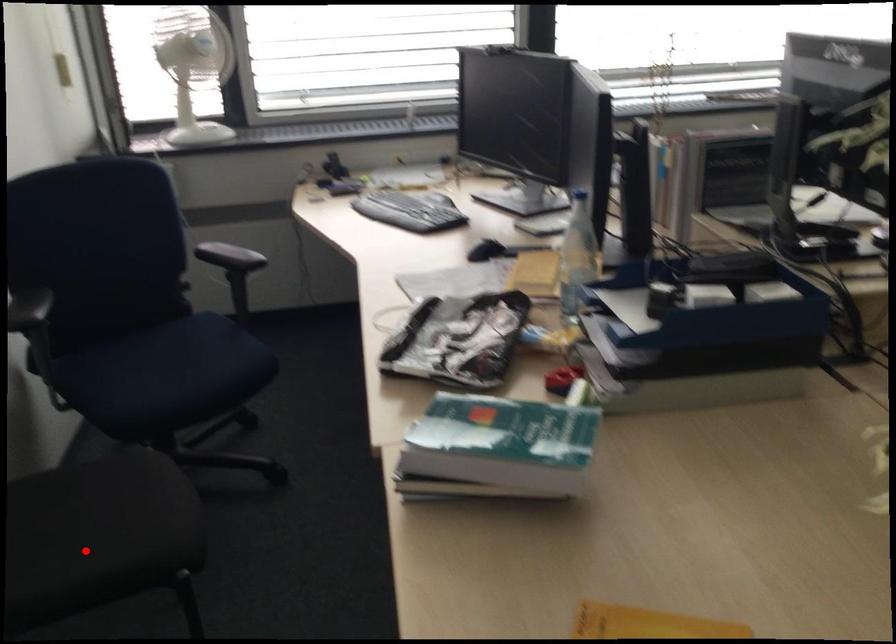
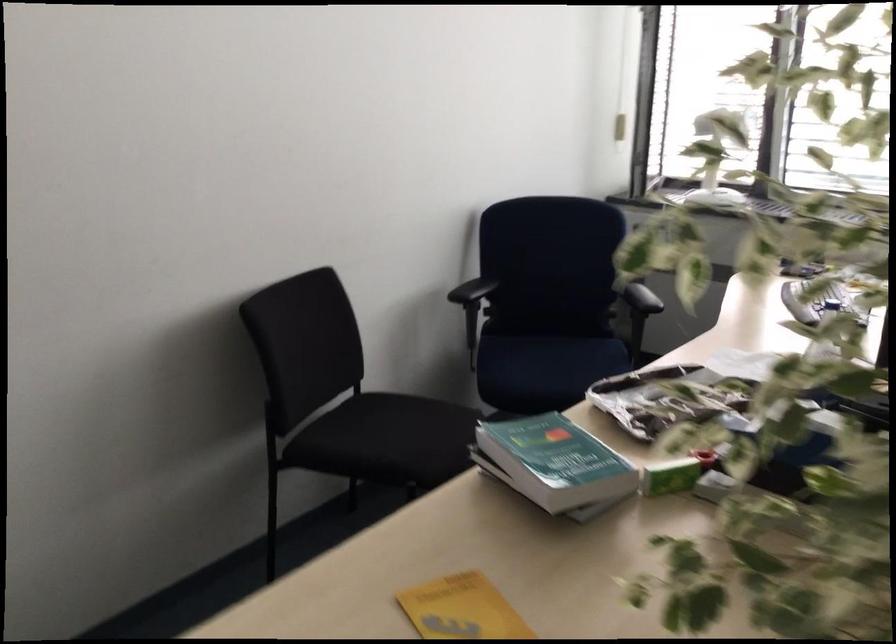
Question: I am providing you with two images of the same scene from different viewpoints. Image1 has a red point marked. In image2, the corresponding 3D location appears at what relative position? Reply with the corresponding letter.

Choices:
 (A) Closer
 (B) Farther

Answer: (B)